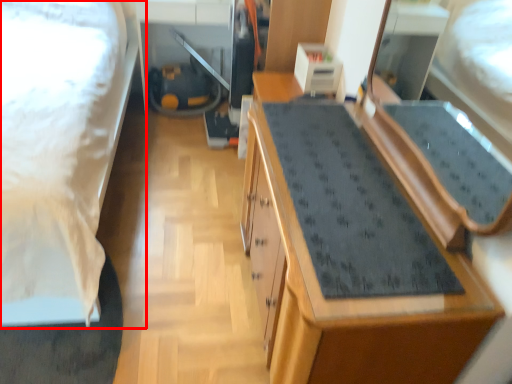
Question: From the image, what is the correct spatial relationship of bed (annotated by the red box) in relation to cabinetry?

Choices:
 (A) right
 (B) left

Answer: (B)